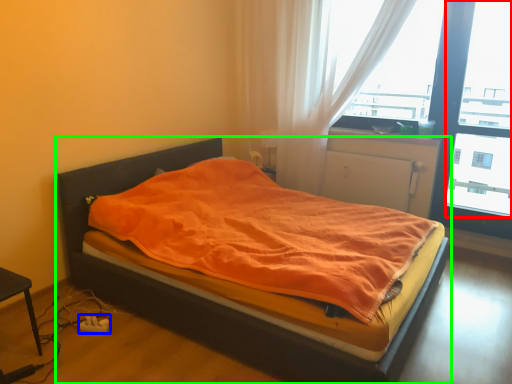
Question: Which object is the farthest from window screen (highlighted by a red box)? Choose among these: charger (highlighted by a blue box) or bed (highlighted by a green box).

Choices:
 (A) charger
 (B) bed

Answer: (A)